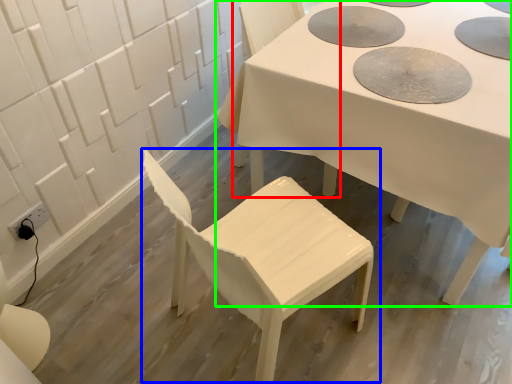
Question: Considering the real-world distances, which object is closest to chair (highlighted by a red box)? chair (highlighted by a blue box) or table (highlighted by a green box).

Choices:
 (A) chair
 (B) table

Answer: (B)